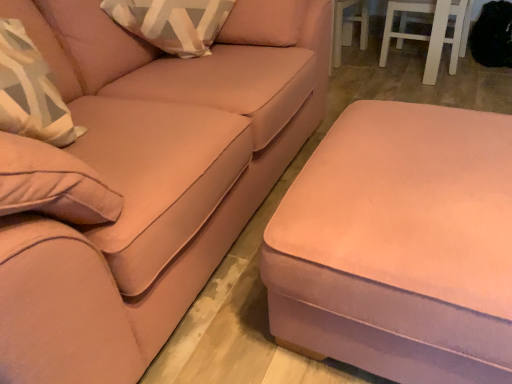
Question: From the image's perspective, relative to matte pink ottoman at lower right, is matte pink ottoman at lower right above or below?

Choices:
 (A) above
 (B) below

Answer: (A)

Question: In the image, is matte pink ottoman at lower right on the left side or the right side of matte pink ottoman at lower right?

Choices:
 (A) right
 (B) left

Answer: (B)

Question: Looking at the image, does matte pink ottoman at lower right seem bigger or smaller compared to matte pink ottoman at lower right?

Choices:
 (A) small
 (B) big

Answer: (B)

Question: Considering the positions of point (346, 109) and point (125, 66), is point (346, 109) closer or farther from the camera than point (125, 66)?

Choices:
 (A) closer
 (B) farther

Answer: (A)

Question: Which is correct: matte pink ottoman at lower right is inside matte pink ottoman at lower right, or outside of it?

Choices:
 (A) outside
 (B) inside

Answer: (A)

Question: Looking at the image, does matte pink ottoman at lower right seem bigger or smaller compared to matte pink ottoman at lower right?

Choices:
 (A) big
 (B) small

Answer: (B)

Question: From a real-world perspective, is matte pink ottoman at lower right positioned above or below matte pink ottoman at lower right?

Choices:
 (A) above
 (B) below

Answer: (B)